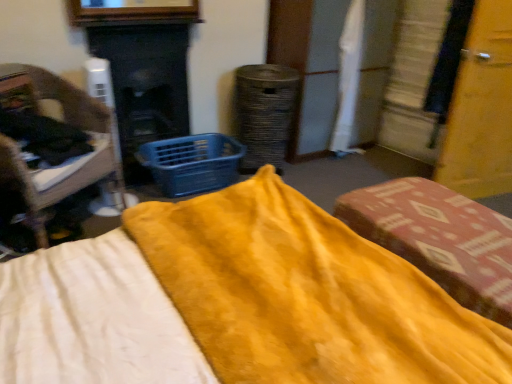
Question: Can you confirm if blue plastic basket at center is taller than yellow soft fabric bed at center?

Choices:
 (A) no
 (B) yes

Answer: (B)

Question: Can you confirm if blue plastic basket at center is positioned to the left of yellow soft fabric bed at center?

Choices:
 (A) no
 (B) yes

Answer: (B)

Question: Does blue plastic basket at center lie behind yellow soft fabric bed at center?

Choices:
 (A) no
 (B) yes

Answer: (B)

Question: Is blue plastic basket at center in front of yellow soft fabric bed at center?

Choices:
 (A) no
 (B) yes

Answer: (A)

Question: Can yellow soft fabric bed at center be found inside blue plastic basket at center?

Choices:
 (A) yes
 (B) no

Answer: (B)

Question: From a real-world perspective, is blue plastic basket at center positioned over yellow soft fabric bed at center based on gravity?

Choices:
 (A) no
 (B) yes

Answer: (A)

Question: Does wooden chair at left, the second furniture viewed from the right, have a greater height compared to velvet yellow cushion at center, marked as the first furniture in a right-to-left arrangement?

Choices:
 (A) yes
 (B) no

Answer: (A)

Question: Is velvet yellow cushion at center, which is the 2th furniture from left to right, inside wooden chair at left, placed as the 1th furniture when sorted from left to right?

Choices:
 (A) no
 (B) yes

Answer: (A)

Question: Is wooden chair at left, the second furniture viewed from the right, located outside velvet yellow cushion at center, which is the 2th furniture from left to right?

Choices:
 (A) yes
 (B) no

Answer: (A)

Question: Considering the relative sizes of wooden chair at left, the second furniture viewed from the right, and velvet yellow cushion at center, which is the 2th furniture from left to right, in the image provided, is wooden chair at left, the second furniture viewed from the right, wider than velvet yellow cushion at center, which is the 2th furniture from left to right,?

Choices:
 (A) yes
 (B) no

Answer: (A)

Question: From a real-world perspective, is wooden chair at left, the second furniture viewed from the right, positioned under velvet yellow cushion at center, which is the 2th furniture from left to right, based on gravity?

Choices:
 (A) no
 (B) yes

Answer: (A)

Question: Is the depth of wooden chair at left, the second furniture viewed from the right, greater than that of velvet yellow cushion at center, marked as the first furniture in a right-to-left arrangement?

Choices:
 (A) no
 (B) yes

Answer: (B)

Question: Is blue plastic basket at center completely or partially inside smooth black fireplace at center-left?

Choices:
 (A) yes
 (B) no

Answer: (B)